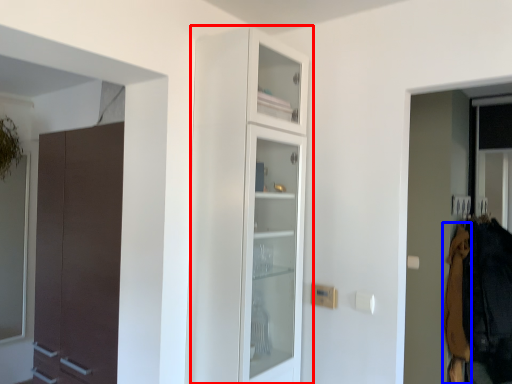
Question: Which object is further to the camera taking this photo, cupboard (highlighted by a red box) or clothing (highlighted by a blue box)?

Choices:
 (A) cupboard
 (B) clothing

Answer: (B)